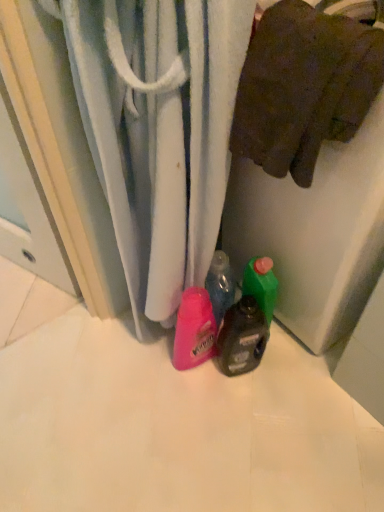
Question: From the image's perspective, is white textured towel at center on translucent plastic bottle at center?

Choices:
 (A) no
 (B) yes

Answer: (B)

Question: Does white textured towel at center come in front of translucent plastic bottle at center?

Choices:
 (A) yes
 (B) no

Answer: (A)

Question: Is white textured towel at center at the right side of translucent plastic bottle at center?

Choices:
 (A) yes
 (B) no

Answer: (B)

Question: Is white textured towel at center at the left side of translucent plastic bottle at center?

Choices:
 (A) yes
 (B) no

Answer: (A)

Question: Is white textured towel at center positioned beyond the bounds of translucent plastic bottle at center?

Choices:
 (A) yes
 (B) no

Answer: (A)

Question: Is white textured towel at center thinner than translucent plastic bottle at center?

Choices:
 (A) yes
 (B) no

Answer: (B)

Question: Can you confirm if brown cotton towel at upper right is taller than white textured towel at center?

Choices:
 (A) no
 (B) yes

Answer: (A)

Question: Can you confirm if brown cotton towel at upper right is bigger than white textured towel at center?

Choices:
 (A) no
 (B) yes

Answer: (A)

Question: Is brown cotton towel at upper right positioned far away from white textured towel at center?

Choices:
 (A) no
 (B) yes

Answer: (A)

Question: From the image's perspective, is brown cotton towel at upper right beneath white textured towel at center?

Choices:
 (A) yes
 (B) no

Answer: (B)

Question: From the image's perspective, is brown cotton towel at upper right located above white textured towel at center?

Choices:
 (A) no
 (B) yes

Answer: (B)

Question: Is the depth of brown cotton towel at upper right greater than that of white textured towel at center?

Choices:
 (A) no
 (B) yes

Answer: (B)

Question: Is brown cotton towel at upper right facing towards translucent plastic bottle at center?

Choices:
 (A) no
 (B) yes

Answer: (A)